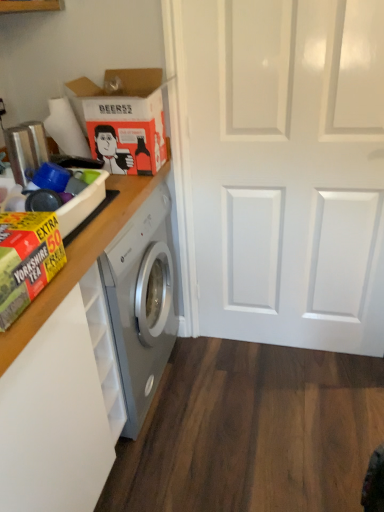
What do you see at coordinates (26, 260) in the screenshot? The height and width of the screenshot is (512, 384). I see `yellow-green cardboard box at left, which is the first cardboard box from front to back` at bounding box center [26, 260].

What do you see at coordinates (284, 169) in the screenshot? This screenshot has width=384, height=512. I see `white glossy door at center` at bounding box center [284, 169].

Find the location of a particular element. The width and height of the screenshot is (384, 512). white glossy door at center is located at coordinates (284, 169).

What is the approximate height of wooden counter at left?

wooden counter at left is 38.78 inches tall.

Identify the location of wooden counter at left. The height and width of the screenshot is (512, 384). (79, 260).

Where is `orange matte cardboard box at upper left, marked as the first cardboard box in a top-to-bottom arrangement`? orange matte cardboard box at upper left, marked as the first cardboard box in a top-to-bottom arrangement is located at coordinates (123, 119).

Is yellow-green cardboard box at left, the 1th cardboard box when ordered from bottom to top, aimed at yellow cardboard box at left?

No, yellow-green cardboard box at left, the 1th cardboard box when ordered from bottom to top, is not aimed at yellow cardboard box at left.

Can you confirm if yellow-green cardboard box at left, which is the first cardboard box from front to back, is smaller than yellow cardboard box at left?

Yes.

How distant is yellow-green cardboard box at left, the 1th cardboard box when ordered from bottom to top, from yellow cardboard box at left?

yellow-green cardboard box at left, the 1th cardboard box when ordered from bottom to top, is 9.31 inches away from yellow cardboard box at left.

Which object is wider, yellow-green cardboard box at left, the second cardboard box when ordered from back to front, or yellow cardboard box at left?

yellow cardboard box at left.

Is point (119, 199) positioned behind point (289, 151)?

That is False.

From the image's perspective, who appears lower, wooden counter at left or white glossy door at center?

wooden counter at left is shown below in the image.

Is the position of wooden counter at left more distant than that of white glossy door at center?

No, wooden counter at left is closer to the camera.

Which of these two, yellow-green cardboard box at left, marked as the second cardboard box in a top-to-bottom arrangement, or wooden counter at left, is thinner?

With smaller width is yellow-green cardboard box at left, marked as the second cardboard box in a top-to-bottom arrangement.

From a real-world perspective, is yellow-green cardboard box at left, the 1th cardboard box when ordered from bottom to top, physically located above or below wooden counter at left?

yellow-green cardboard box at left, the 1th cardboard box when ordered from bottom to top, is situated higher than wooden counter at left in the real world.

How many degrees apart are the facing directions of yellow-green cardboard box at left, marked as the second cardboard box in a top-to-bottom arrangement, and wooden counter at left?

There is a 1.23-degree angle between the facing directions of yellow-green cardboard box at left, marked as the second cardboard box in a top-to-bottom arrangement, and wooden counter at left.

From the image's perspective, which one is positioned lower, yellow-green cardboard box at left, the 1th cardboard box when ordered from bottom to top, or wooden counter at left?

wooden counter at left, from the image's perspective.

From the image's perspective, which is above, orange matte cardboard box at upper left, the first cardboard box when ordered from back to front, or yellow cardboard box at left?

From the image's view, orange matte cardboard box at upper left, the first cardboard box when ordered from back to front, is above.

Which object is closer to the camera taking this photo, orange matte cardboard box at upper left, the first cardboard box when ordered from back to front, or yellow cardboard box at left?

yellow cardboard box at left is in front.

Could you tell me if orange matte cardboard box at upper left, the first cardboard box when ordered from back to front, is turned towards yellow cardboard box at left?

No, orange matte cardboard box at upper left, the first cardboard box when ordered from back to front, is not turned towards yellow cardboard box at left.

Would you say orange matte cardboard box at upper left, the 2th cardboard box in the front-to-back sequence, is outside yellow cardboard box at left?

Yes, orange matte cardboard box at upper left, the 2th cardboard box in the front-to-back sequence, is located beyond the bounds of yellow cardboard box at left.

Considering their positions, is yellow-green cardboard box at left, the second cardboard box when ordered from back to front, located in front of or behind orange matte cardboard box at upper left, the 2th cardboard box in the front-to-back sequence?

Visually, yellow-green cardboard box at left, the second cardboard box when ordered from back to front, is located in front of orange matte cardboard box at upper left, the 2th cardboard box in the front-to-back sequence.

Measure the distance from yellow-green cardboard box at left, the 1th cardboard box when ordered from bottom to top, to orange matte cardboard box at upper left, arranged as the 2th cardboard box when ordered from the bottom.

A distance of 27.03 inches exists between yellow-green cardboard box at left, the 1th cardboard box when ordered from bottom to top, and orange matte cardboard box at upper left, arranged as the 2th cardboard box when ordered from the bottom.

Which of these two, yellow-green cardboard box at left, marked as the second cardboard box in a top-to-bottom arrangement, or orange matte cardboard box at upper left, the 2th cardboard box in the front-to-back sequence, is thinner?

yellow-green cardboard box at left, marked as the second cardboard box in a top-to-bottom arrangement, is thinner.

Based on the photo, from the image's perspective, which one is positioned lower, yellow-green cardboard box at left, marked as the second cardboard box in a top-to-bottom arrangement, or orange matte cardboard box at upper left, arranged as the 2th cardboard box when ordered from the bottom?

yellow-green cardboard box at left, marked as the second cardboard box in a top-to-bottom arrangement, from the image's perspective.

Considering the relative sizes of yellow cardboard box at left and orange matte cardboard box at upper left, arranged as the 2th cardboard box when ordered from the bottom, in the image provided, is yellow cardboard box at left bigger than orange matte cardboard box at upper left, arranged as the 2th cardboard box when ordered from the bottom,?

Actually, yellow cardboard box at left might be smaller than orange matte cardboard box at upper left, arranged as the 2th cardboard box when ordered from the bottom.

What's the angular difference between yellow cardboard box at left and orange matte cardboard box at upper left, marked as the first cardboard box in a top-to-bottom arrangement,'s facing directions?

The angular difference between yellow cardboard box at left and orange matte cardboard box at upper left, marked as the first cardboard box in a top-to-bottom arrangement, is 5.08 degrees.

From the picture: Between yellow cardboard box at left and orange matte cardboard box at upper left, the 2th cardboard box in the front-to-back sequence, which one has more height?

Standing taller between the two is orange matte cardboard box at upper left, the 2th cardboard box in the front-to-back sequence.

Which of these two, white glossy door at center or yellow cardboard box at left, is thinner?

With smaller width is white glossy door at center.

I want to click on screen door that is on the right side of yellow cardboard box at left, so click(x=284, y=169).

In the image, is white glossy door at center on the left side or the right side of yellow cardboard box at left?

Clearly, white glossy door at center is on the right of yellow cardboard box at left in the image.

Considering the positions of objects white glossy door at center and yellow cardboard box at left in the image provided, who is behind, white glossy door at center or yellow cardboard box at left?

white glossy door at center is further away from the camera.

The image size is (384, 512). I want to click on cardboard box that appears below the yellow cardboard box at left (from the image's perspective), so click(x=26, y=260).

At what (x,y) coordinates should I click in order to perform the action: click on screen door positioned vertically above the wooden counter at left (from a real-world perspective). Please return your answer as a coordinate pair (x, y). Image resolution: width=384 pixels, height=512 pixels. Looking at the image, I should click on (284, 169).

When comparing their distances from yellow cardboard box at left, does white glossy door at center or wooden counter at left seem further?

white glossy door at center.

When comparing their distances from wooden counter at left, does yellow cardboard box at left or white glossy door at center seem closer?

yellow cardboard box at left is positioned closer to the anchor wooden counter at left.

Estimate the real-world distances between objects in this image. Which object is further from white glossy door at center, orange matte cardboard box at upper left, arranged as the 2th cardboard box when ordered from the bottom, or yellow cardboard box at left?

yellow cardboard box at left.

From the image, which object appears to be farther from orange matte cardboard box at upper left, arranged as the 2th cardboard box when ordered from the bottom, white glossy door at center or yellow cardboard box at left?

white glossy door at center lies further to orange matte cardboard box at upper left, arranged as the 2th cardboard box when ordered from the bottom, than the other object.

Considering their positions, is orange matte cardboard box at upper left, marked as the first cardboard box in a top-to-bottom arrangement, positioned closer to yellow-green cardboard box at left, the 1th cardboard box when ordered from bottom to top, than white glossy door at center?

orange matte cardboard box at upper left, marked as the first cardboard box in a top-to-bottom arrangement, is closer to yellow-green cardboard box at left, the 1th cardboard box when ordered from bottom to top.

When comparing their distances from yellow cardboard box at left, does yellow-green cardboard box at left, the second cardboard box when ordered from back to front, or white glossy door at center seem further?

white glossy door at center.

Looking at the image, which one is located further to orange matte cardboard box at upper left, the first cardboard box when ordered from back to front, wooden counter at left or yellow-green cardboard box at left, the 1th cardboard box when ordered from bottom to top?

yellow-green cardboard box at left, the 1th cardboard box when ordered from bottom to top, is further to orange matte cardboard box at upper left, the first cardboard box when ordered from back to front.

Looking at this image, estimate the real-world distances between objects in this image. Which object is further from yellow cardboard box at left, wooden counter at left or orange matte cardboard box at upper left, marked as the first cardboard box in a top-to-bottom arrangement?

Based on the image, orange matte cardboard box at upper left, marked as the first cardboard box in a top-to-bottom arrangement, appears to be further to yellow cardboard box at left.

Find the location of `box between orange matte cardboard box at upper left, arranged as the 2th cardboard box when ordered from the bottom, and wooden counter at left vertically`. box between orange matte cardboard box at upper left, arranged as the 2th cardboard box when ordered from the bottom, and wooden counter at left vertically is located at coordinates (82, 200).

At what (x,y) coordinates should I click in order to perform the action: click on counter top between yellow cardboard box at left and white glossy door at center in the horizontal direction. Please return your answer as a coordinate pair (x, y). This screenshot has width=384, height=512. Looking at the image, I should click on (79, 260).

The image size is (384, 512). In order to click on cardboard box located between yellow-green cardboard box at left, marked as the second cardboard box in a top-to-bottom arrangement, and white glossy door at center in the left-right direction in this screenshot , I will do pyautogui.click(x=123, y=119).

Image resolution: width=384 pixels, height=512 pixels. I want to click on cardboard box between orange matte cardboard box at upper left, the first cardboard box when ordered from back to front, and wooden counter at left from top to bottom, so click(x=26, y=260).